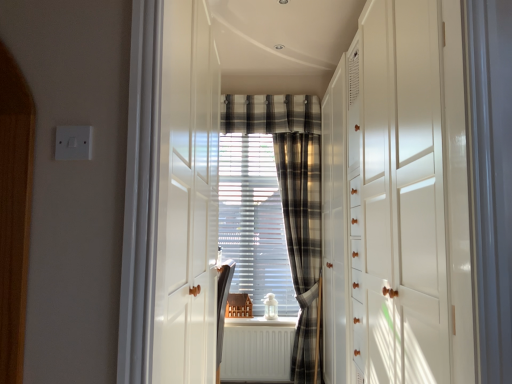
At what (x,y) coordinates should I click in order to perform the action: click on free space above plaid fabric at center (from a real-world perspective). Please return your answer as a coordinate pair (x, y). This screenshot has height=384, width=512. Looking at the image, I should click on (270, 103).